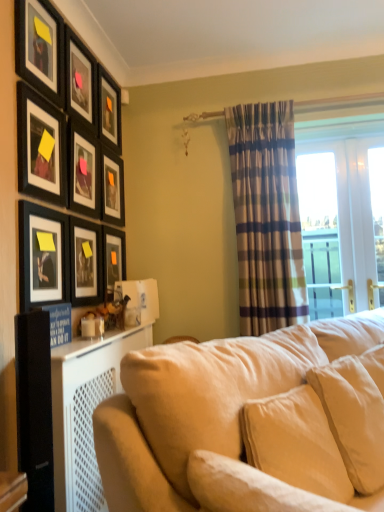
Question: Does matte black picture frame at left, acting as the 2th picture frame starting from the bottom, come behind matte black picture frame at upper left, acting as the 6th picture frame starting from the top?

Choices:
 (A) no
 (B) yes

Answer: (A)

Question: Does matte black picture frame at left, the 8th picture frame viewed from the top, have a larger size compared to matte black picture frame at upper left, acting as the 4th picture frame starting from the bottom?

Choices:
 (A) yes
 (B) no

Answer: (A)

Question: Would you say matte black picture frame at left, acting as the 2th picture frame starting from the bottom, is a long distance from matte black picture frame at upper left, acting as the 4th picture frame starting from the bottom?

Choices:
 (A) no
 (B) yes

Answer: (A)

Question: From the image's perspective, does matte black picture frame at left, the 8th picture frame viewed from the top, appear higher than matte black picture frame at upper left, acting as the 4th picture frame starting from the bottom?

Choices:
 (A) no
 (B) yes

Answer: (A)

Question: Is matte black picture frame at left, acting as the 2th picture frame starting from the bottom, surrounding matte black picture frame at upper left, acting as the 4th picture frame starting from the bottom?

Choices:
 (A) yes
 (B) no

Answer: (B)

Question: Can you confirm if matte black picture frame at left, acting as the 2th picture frame starting from the bottom, is smaller than matte black picture frame at upper left, acting as the 4th picture frame starting from the bottom?

Choices:
 (A) yes
 (B) no

Answer: (B)

Question: Is matte black picture frame at upper left, the 7th picture frame when ordered from bottom to top, touching matte black picture frame at upper left, the fourth picture frame when ordered from top to bottom?

Choices:
 (A) no
 (B) yes

Answer: (A)

Question: Is the depth of matte black picture frame at upper left, the third picture frame positioned from the top, less than that of matte black picture frame at upper left, which is counted as the sixth picture frame, starting from the bottom?

Choices:
 (A) yes
 (B) no

Answer: (B)

Question: Is the position of matte black picture frame at upper left, the third picture frame positioned from the top, more distant than that of matte black picture frame at upper left, the fourth picture frame when ordered from top to bottom?

Choices:
 (A) yes
 (B) no

Answer: (A)

Question: From a real-world perspective, is matte black picture frame at upper left, the 7th picture frame when ordered from bottom to top, physically above matte black picture frame at upper left, which is counted as the sixth picture frame, starting from the bottom?

Choices:
 (A) yes
 (B) no

Answer: (A)

Question: Is matte black picture frame at upper left, the third picture frame positioned from the top, far from matte black picture frame at upper left, the fourth picture frame when ordered from top to bottom?

Choices:
 (A) no
 (B) yes

Answer: (A)

Question: From a real-world perspective, is matte black picture frame at upper left, the third picture frame positioned from the top, positioned under matte black picture frame at upper left, which is counted as the sixth picture frame, starting from the bottom, based on gravity?

Choices:
 (A) no
 (B) yes

Answer: (A)

Question: Is matte black picture frame at upper left, the 5th picture frame from the bottom, shorter than matte black picture frame at upper left, which appears as the 2th picture frame when viewed from the top?

Choices:
 (A) yes
 (B) no

Answer: (B)